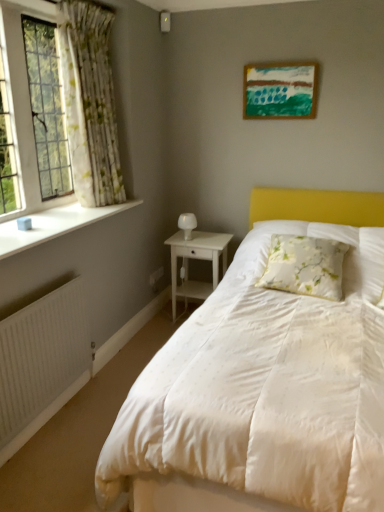
This screenshot has height=512, width=384. I want to click on free space on the front side of white ribbed radiator at lower left, so click(55, 458).